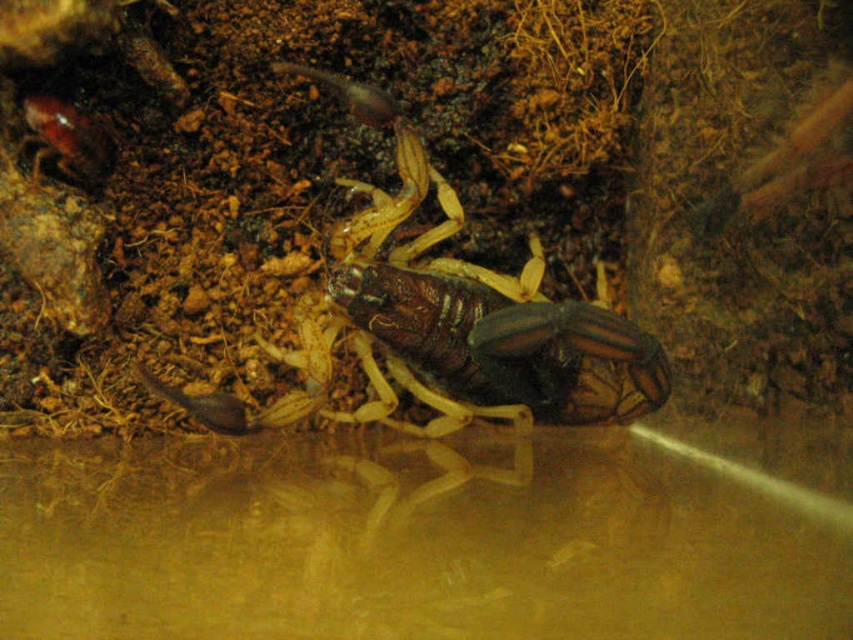
Which is more to the left, brown shiny scorpion at center or shiny brown beetle at upper left?

Positioned to the left is shiny brown beetle at upper left.

From the picture: Does brown shiny scorpion at center have a lesser height compared to shiny brown beetle at upper left?

No.

The height and width of the screenshot is (640, 853). Describe the element at coordinates (445, 323) in the screenshot. I see `brown shiny scorpion at center` at that location.

Find the location of a particular element. brown shiny scorpion at center is located at coordinates (445, 323).